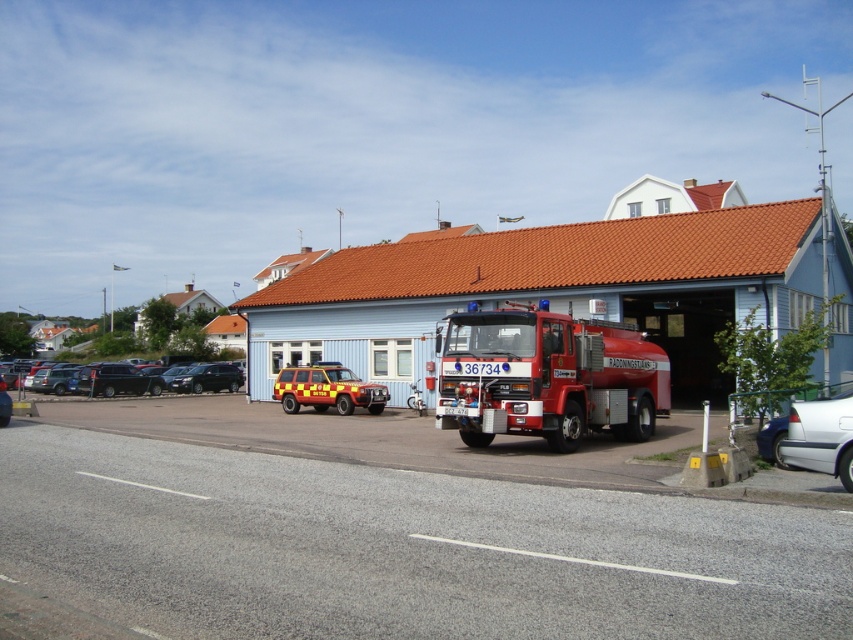
Which is below, shiny red fire truck at center or yellow matte suv at center?

Positioned lower is yellow matte suv at center.

What do you see at coordinates (547, 376) in the screenshot? The width and height of the screenshot is (853, 640). I see `shiny red fire truck at center` at bounding box center [547, 376].

The height and width of the screenshot is (640, 853). Find the location of `shiny red fire truck at center`. shiny red fire truck at center is located at coordinates [547, 376].

Describe the element at coordinates (547, 376) in the screenshot. The image size is (853, 640). I see `shiny red fire truck at center` at that location.

What do you see at coordinates (547, 376) in the screenshot?
I see `shiny red fire truck at center` at bounding box center [547, 376].

Locate an element on the screen. shiny red fire truck at center is located at coordinates (547, 376).

Is shiny red fire truck at center to the left of silver metallic sedan at lower right from the viewer's perspective?

Yes, shiny red fire truck at center is to the left of silver metallic sedan at lower right.

Who is higher up, shiny red fire truck at center or silver metallic sedan at lower right?

silver metallic sedan at lower right

Between point (469, 348) and point (845, 474), which one is positioned behind?

The point (469, 348) is more distant.

At what (x,y) coordinates should I click in order to perform the action: click on shiny red fire truck at center. Please return your answer as a coordinate pair (x, y). This screenshot has height=640, width=853. Looking at the image, I should click on (547, 376).